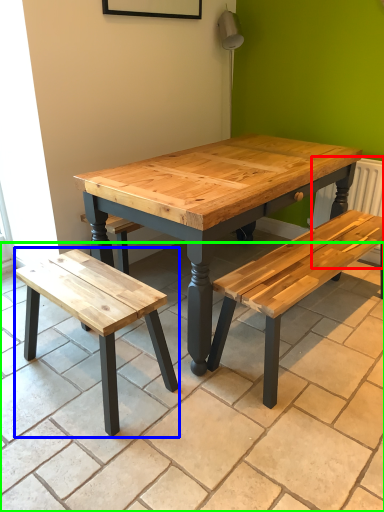
Question: Estimate the real-world distances between objects in this image. Which object is closer to radiator (highlighted by a red box), bench (highlighted by a blue box) or tile (highlighted by a green box)?

Choices:
 (A) bench
 (B) tile

Answer: (B)